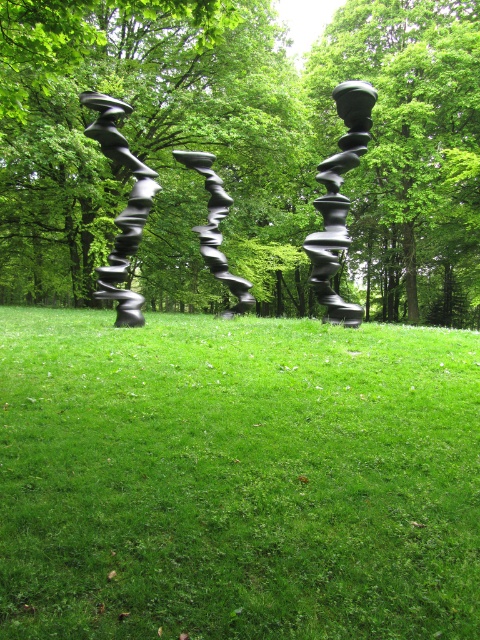
You are standing in front of the three sculptures on the lawn. You notice two points marked on the ground at coordinates point (349, 92) and point (113, 118). If you want to walk towards the point that is closer to you, which coordinate should you head towards?

You should head towards point (349, 92) because it is closer to the camera than point (113, 118).

You are standing in the middle of the lawn and want to place a new sculpture exactly where the green grass at center is located. Based on the coordinates provided, can you confirm if this position is suitable for placing the sculpture?

The green grass at center is located at coordinates point [236,477], so yes, the position is suitable for placing the sculpture as it is at the center of the lawn.

You are standing in the middle of the lawn and want to place a new decorative rock exactly where the green grass at center is. According to the coordinates provided, where should you place the rock?

The green grass at center is located at point (236, 477), so you should place the rock at those coordinates.